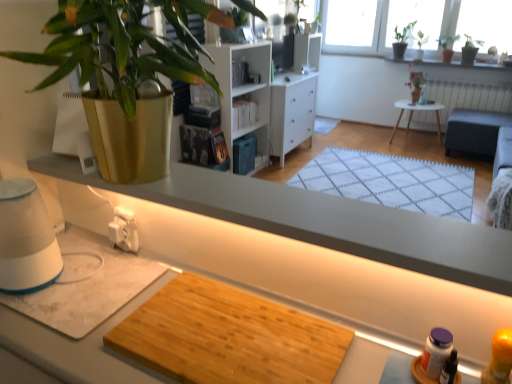
Question: Considering the relative sizes of white wood bookshelf at center and wooden cutting board at center in the image provided, is white wood bookshelf at center shorter than wooden cutting board at center?

Choices:
 (A) no
 (B) yes

Answer: (A)

Question: From the image's perspective, is white wood bookshelf at center under wooden cutting board at center?

Choices:
 (A) no
 (B) yes

Answer: (A)

Question: From a real-world perspective, is white wood bookshelf at center under wooden cutting board at center?

Choices:
 (A) yes
 (B) no

Answer: (A)

Question: From a real-world perspective, is white wood bookshelf at center physically above wooden cutting board at center?

Choices:
 (A) yes
 (B) no

Answer: (B)

Question: Does white wood bookshelf at center come behind wooden cutting board at center?

Choices:
 (A) no
 (B) yes

Answer: (B)

Question: Is white wood bookshelf at center far away from wooden cutting board at center?

Choices:
 (A) yes
 (B) no

Answer: (A)

Question: From a real-world perspective, is white painted radiator at upper right on top of green leafy plant at upper right, marked as the first houseplant in a back-to-front arrangement?

Choices:
 (A) yes
 (B) no

Answer: (B)

Question: Is white painted radiator at upper right oriented towards green leafy plant at upper right, which ranks as the fourth houseplant in front-to-back order?

Choices:
 (A) no
 (B) yes

Answer: (A)

Question: Is white painted radiator at upper right wider than green leafy plant at upper right, the second houseplant when ordered from left to right?

Choices:
 (A) no
 (B) yes

Answer: (A)

Question: From the image's perspective, does white painted radiator at upper right appear higher than green leafy plant at upper right, the 3th houseplant from the right?

Choices:
 (A) no
 (B) yes

Answer: (A)

Question: Considering the relative sizes of white painted radiator at upper right and green leafy plant at upper right, which ranks as the fourth houseplant in front-to-back order, in the image provided, is white painted radiator at upper right smaller than green leafy plant at upper right, which ranks as the fourth houseplant in front-to-back order,?

Choices:
 (A) yes
 (B) no

Answer: (B)

Question: Is white painted radiator at upper right positioned in front of green leafy plant at upper right, marked as the 1th houseplant in a top-to-bottom arrangement?

Choices:
 (A) yes
 (B) no

Answer: (A)

Question: From the image's perspective, is green leafy plant at upper right, acting as the 3th houseplant starting from the bottom, under green leafy plant at upper right, marked as the 1th houseplant in a top-to-bottom arrangement?

Choices:
 (A) yes
 (B) no

Answer: (A)